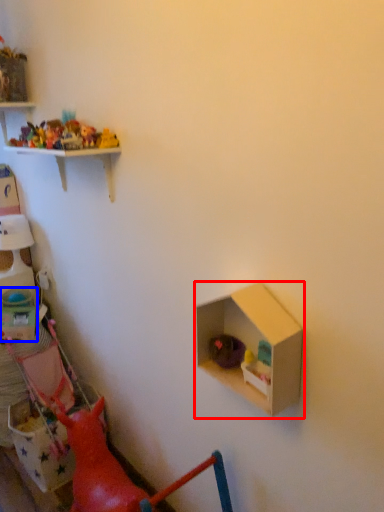
Question: Which object appears closest to the camera in this image, shelf (highlighted by a red box) or box (highlighted by a blue box)?

Choices:
 (A) shelf
 (B) box

Answer: (A)